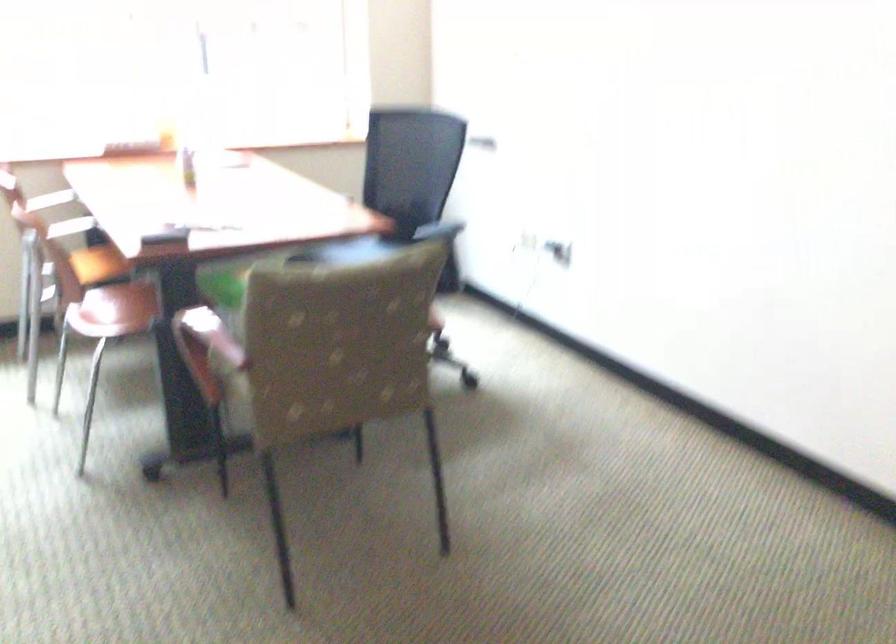
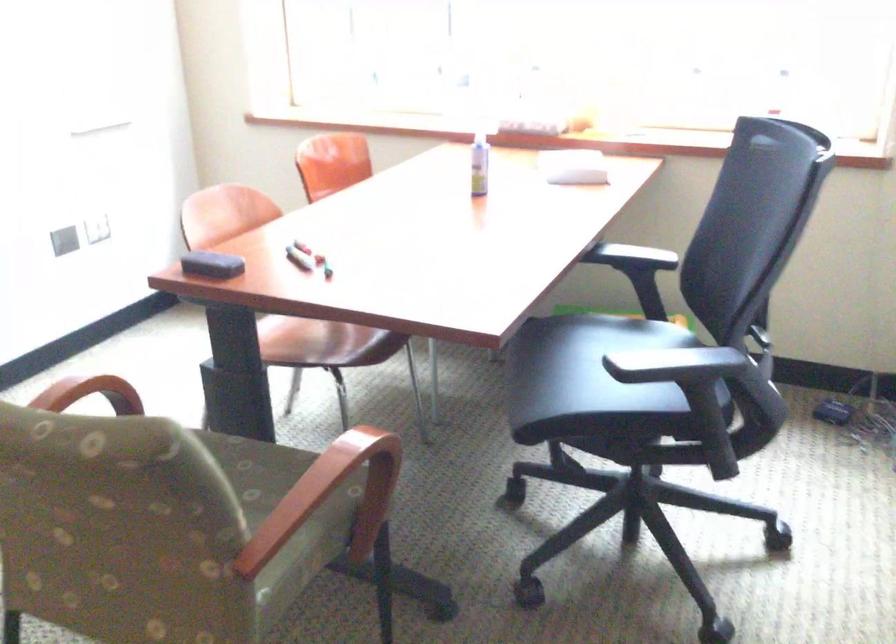
The point at (409, 301) is marked in the first image. Where is the corresponding point in the second image?

(331, 496)